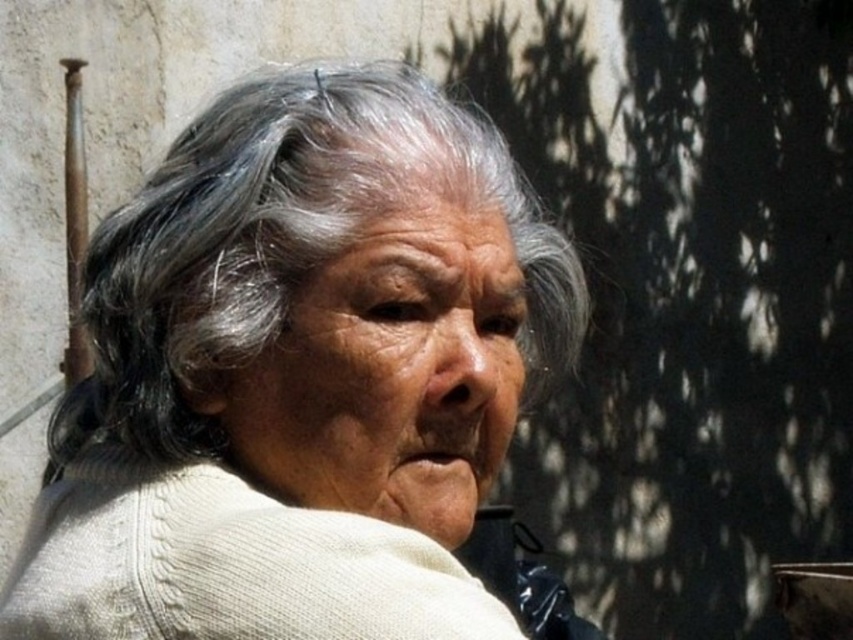
You are an artist sketching this scene. You need to decide which area to focus on first based on their sizes. Which object is wider, the gray matte hair at center or the white knitted sweater at center?

The gray matte hair at center might be wider than the white knitted sweater at center according to the description, so the artist should focus on the gray matte hair at center first as it could be the wider object.

You are an artist sketching this scene. You need to decide the order to draw elements based on their position. Which should you draw first, the gray matte hair at center or the white knitted sweater at center?

The gray matte hair at center should be drawn first because it is positioned above the white knitted sweater at center, so it should be placed on top in the drawing.